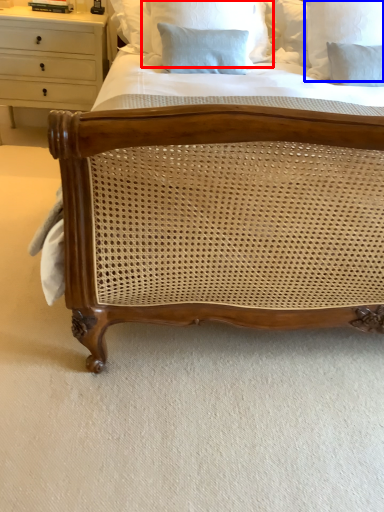
Question: Which of the following is the closest to the observer, pillow (highlighted by a red box) or pillow (highlighted by a blue box)?

Choices:
 (A) pillow
 (B) pillow

Answer: (A)